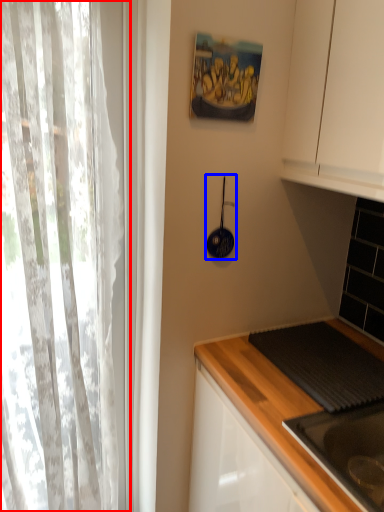
Question: Which object appears farthest to the camera in this image, curtain (highlighted by a red box) or appliance (highlighted by a blue box)?

Choices:
 (A) curtain
 (B) appliance

Answer: (B)